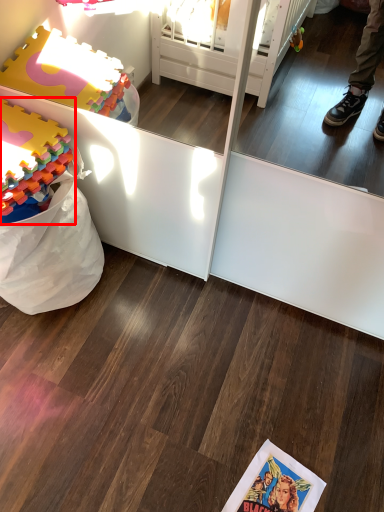
Question: From the image, what is the correct spatial relationship of toy (annotated by the red box) in relation to comic book?

Choices:
 (A) left
 (B) right

Answer: (A)